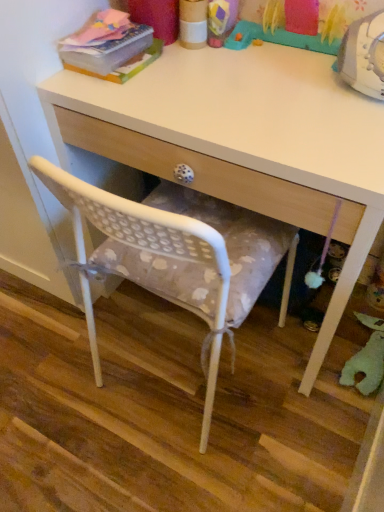
The width and height of the screenshot is (384, 512). What are the coordinates of `vacant space situated above white fabric cushion at center (from a real-world perspective)` in the screenshot? It's located at (157, 386).